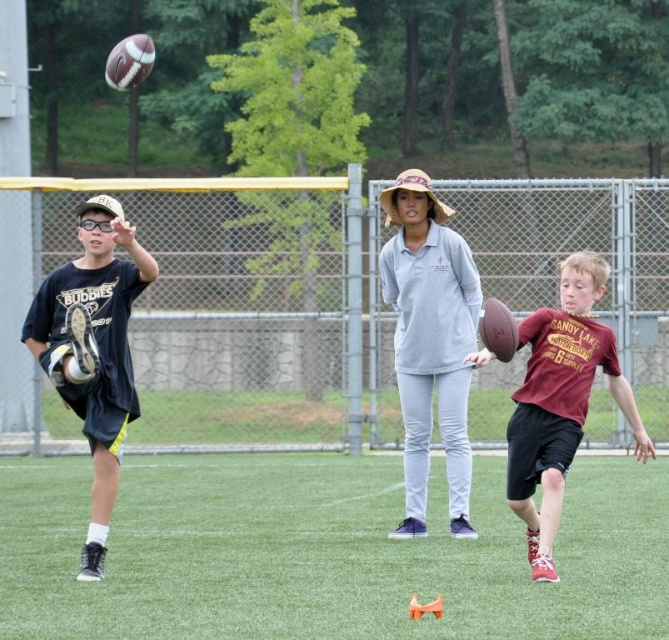
Is the position of gray cotton shirt at center less distant than that of black matte t-shirt at left?

No.

Which of these two, gray cotton shirt at center or black matte t-shirt at left, stands taller?

Standing taller between the two is gray cotton shirt at center.

This screenshot has width=669, height=640. I want to click on gray cotton shirt at center, so click(429, 340).

Can you confirm if gray cotton shirt at center is shorter than maroon jersey at right?

Incorrect, gray cotton shirt at center's height does not fall short of maroon jersey at right's.

Between point (401, 230) and point (624, 404), which one is positioned in front?

Positioned in front is point (624, 404).

Identify the location of gray cotton shirt at center. (429, 340).

Is black matte t-shirt at left below maroon jersey at right?

Incorrect, black matte t-shirt at left is not positioned below maroon jersey at right.

The height and width of the screenshot is (640, 669). What do you see at coordinates (94, 349) in the screenshot?
I see `black matte t-shirt at left` at bounding box center [94, 349].

Which is in front, point (124, 248) or point (577, 259)?

Point (577, 259) is in front.

I want to click on black matte t-shirt at left, so click(94, 349).